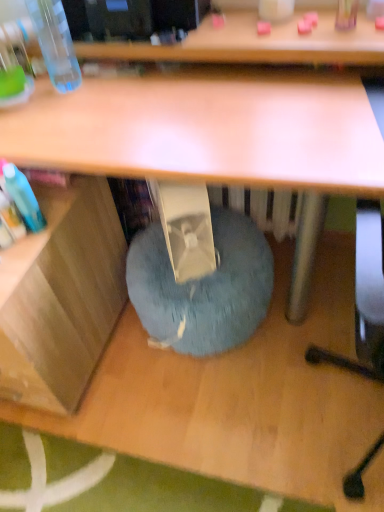
What is the approximate width of wooden at left?

24.56 inches.

Locate an element on the screen. blue fuzzy bean bag at lower center is located at coordinates (203, 287).

Is blue fuzzy bean bag at lower center oriented away from transparent plastic bottle at upper left?

No, transparent plastic bottle at upper left is not at the back of blue fuzzy bean bag at lower center.

From a real-world perspective, is blue fuzzy bean bag at lower center physically located above or below transparent plastic bottle at upper left?

blue fuzzy bean bag at lower center is situated lower than transparent plastic bottle at upper left in the real world.

In terms of height, does blue fuzzy bean bag at lower center look taller or shorter compared to transparent plastic bottle at upper left?

Clearly, blue fuzzy bean bag at lower center is shorter compared to transparent plastic bottle at upper left.

Is point (133, 253) closer or farther from the camera than point (60, 71)?

Point (133, 253).

Is wooden at left in front of or behind transparent plastic bottle at upper left in the image?

Clearly, wooden at left is in front of transparent plastic bottle at upper left.

Which point is more forward, (24, 385) or (73, 73)?

Point (24, 385)

Is wooden at left oriented away from transparent plastic bottle at upper left?

That's not correct — wooden at left is not looking away from transparent plastic bottle at upper left.

Considering the positions of objects wooden at left and transparent plastic bottle at upper left in the image provided, who is more to the left, wooden at left or transparent plastic bottle at upper left?

From the viewer's perspective, wooden at left appears more on the left side.

Considering the sizes of transparent plastic bottle at upper left and blue fuzzy bean bag at lower center in the image, is transparent plastic bottle at upper left bigger or smaller than blue fuzzy bean bag at lower center?

transparent plastic bottle at upper left is smaller than blue fuzzy bean bag at lower center.

Can you tell me how much transparent plastic bottle at upper left and blue fuzzy bean bag at lower center differ in facing direction?

2.2 degrees separate the facing orientations of transparent plastic bottle at upper left and blue fuzzy bean bag at lower center.

Considering the sizes of objects transparent plastic bottle at upper left and blue fuzzy bean bag at lower center in the image provided, who is thinner, transparent plastic bottle at upper left or blue fuzzy bean bag at lower center?

With smaller width is transparent plastic bottle at upper left.

From the image's perspective, which object appears higher, transparent plastic bottle at upper left or blue fuzzy bean bag at lower center?

transparent plastic bottle at upper left appears higher in the image.

Is point (259, 281) closer to camera compared to point (23, 290)?

No, it is not.

From a real-world perspective, relative to wooden at left, is blue fuzzy bean bag at lower center vertically above or below?

From a real-world perspective, blue fuzzy bean bag at lower center is physically below wooden at left.

From the image's perspective, is blue fuzzy bean bag at lower center positioned above or below wooden at left?

From the image's perspective, blue fuzzy bean bag at lower center appears above wooden at left.

Considering the sizes of wooden at left and blue fuzzy bean bag at lower center in the image, is wooden at left wider or thinner than blue fuzzy bean bag at lower center?

Considering their sizes, wooden at left looks broader than blue fuzzy bean bag at lower center.

How different are the orientations of wooden at left and blue fuzzy bean bag at lower center in degrees?

5.25e-05 degrees separate the facing orientations of wooden at left and blue fuzzy bean bag at lower center.

In the scene shown: Which object is closer to the camera, wooden at left or blue fuzzy bean bag at lower center?

wooden at left.

Which of these two, transparent plastic bottle at upper left or wooden at left, is bigger?

Bigger between the two is wooden at left.

Is point (43, 55) positioned in front of point (78, 273)?

No.

From the image's perspective, is transparent plastic bottle at upper left positioned above or below wooden at left?

Based on their image positions, transparent plastic bottle at upper left is located above wooden at left.

You are a GUI agent. You are given a task and a screenshot of the screen. Output one action in this format:
    pyautogui.click(x=<x>, y=<y>)
    Task: Click on the bean bag chair below the transparent plastic bottle at upper left (from a real-world perspective)
    
    Given the screenshot: What is the action you would take?
    (203, 287)

At what (x,y) coordinates should I click in order to perform the action: click on bottle that is behind the wooden at left. Please return your answer as a coordinate pair (x, y). The width and height of the screenshot is (384, 512). Looking at the image, I should click on (55, 42).

When comparing their distances from transparent plastic bottle at upper left, does blue fuzzy bean bag at lower center or wooden at left seem closer?

Based on the image, wooden at left appears to be nearer to transparent plastic bottle at upper left.

From the image, which object appears to be farther from blue fuzzy bean bag at lower center, transparent plastic bottle at upper left or wooden at left?

transparent plastic bottle at upper left.

Looking at this image, considering their positions, is blue fuzzy bean bag at lower center positioned further to wooden at left than transparent plastic bottle at upper left?

transparent plastic bottle at upper left is positioned further to the anchor wooden at left.

From the image, which object appears to be nearer to transparent plastic bottle at upper left, wooden at left or blue fuzzy bean bag at lower center?

The object closer to transparent plastic bottle at upper left is wooden at left.

Which object lies nearer to the anchor point blue fuzzy bean bag at lower center, wooden at left or transparent plastic bottle at upper left?

Result: wooden at left lies closer to blue fuzzy bean bag at lower center than the other object.

Based on their spatial positions, is transparent plastic bottle at upper left or blue fuzzy bean bag at lower center closer to wooden at left?

blue fuzzy bean bag at lower center.

I want to click on bean bag chair between transparent plastic bottle at upper left and wooden at left from top to bottom, so click(x=203, y=287).